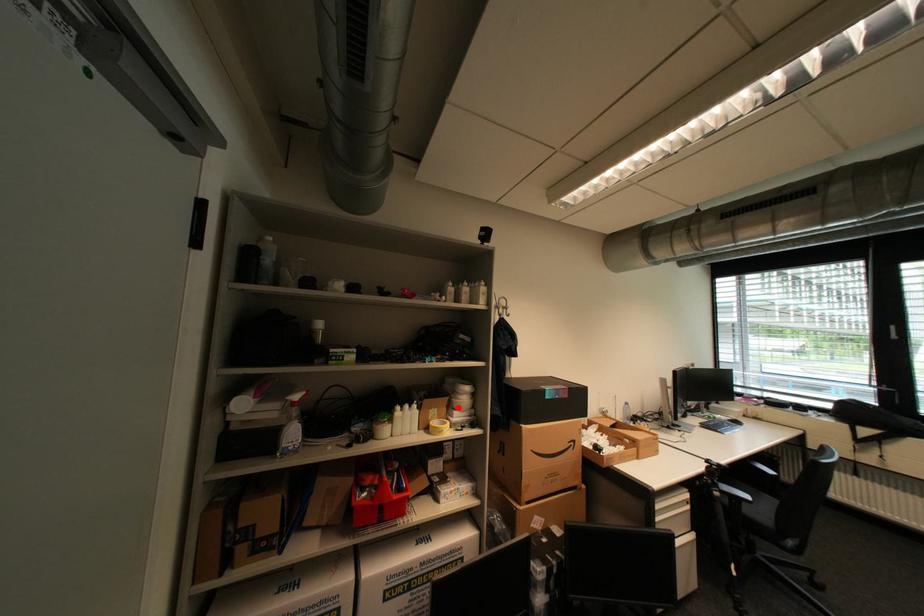
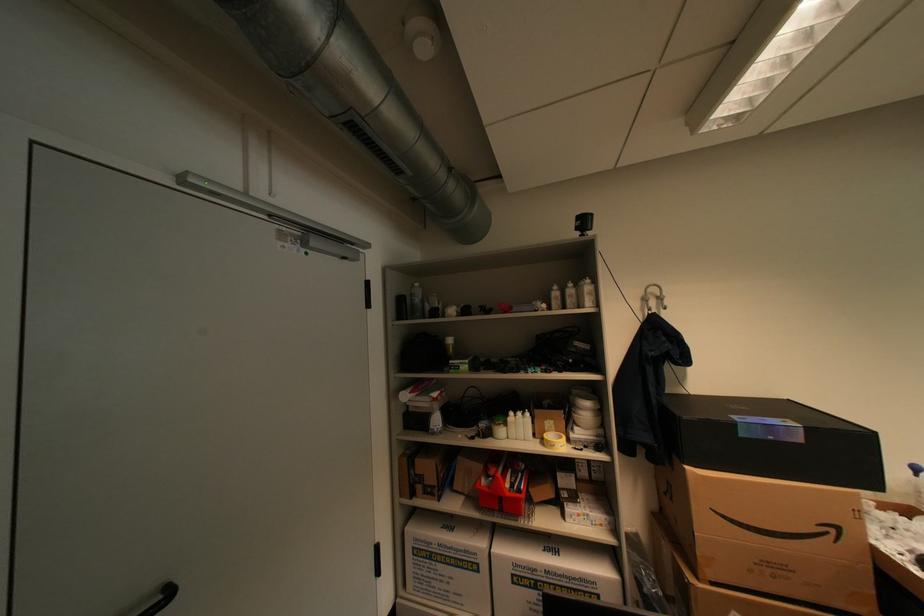
Find the pixel in the second image that matches the highlighted location in the first image.

(578, 422)